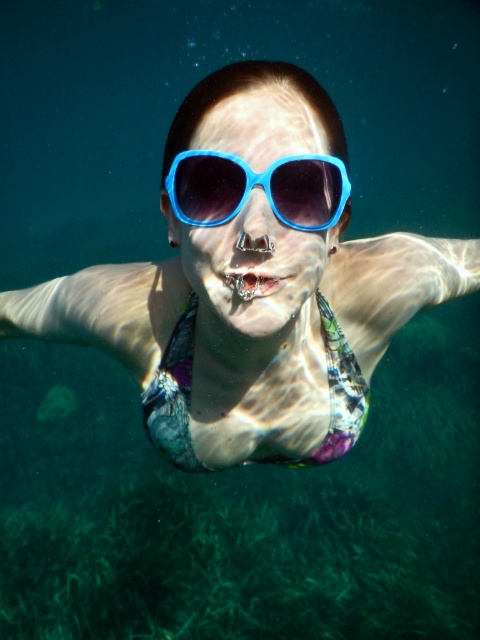
Is point (337, 324) in front of point (315, 189)?

No.

Does multicolored fabric bikini at center lie behind blue plastic goggles at center?

Yes, it is behind blue plastic goggles at center.

Who is more distant from viewer, (345, 376) or (195, 221)?

Point (345, 376)

Locate an element on the screen. multicolored fabric bikini at center is located at coordinates (173, 396).